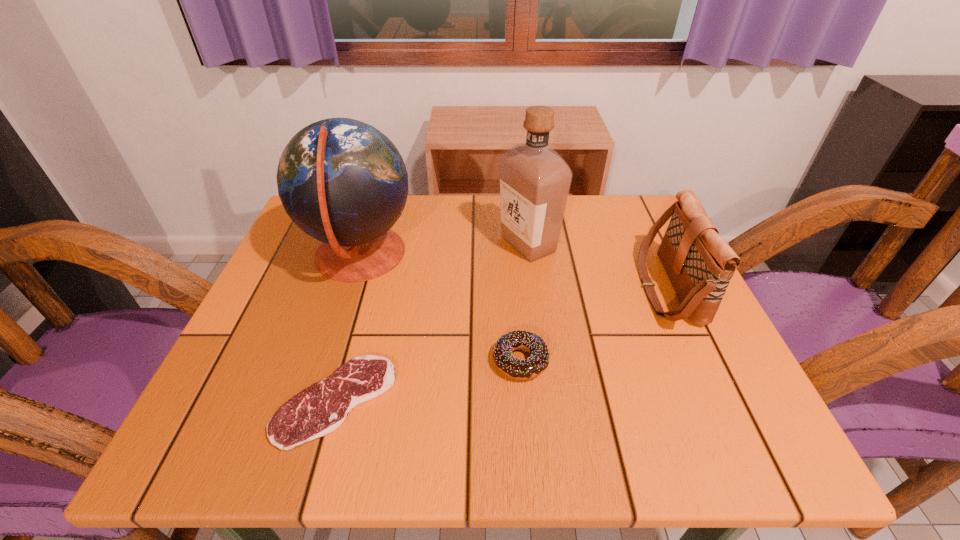
Identify the location of steak that is at the left edge. This screenshot has height=540, width=960. (320, 409).

Find the location of a particular element. object located at the right edge is located at coordinates (699, 263).

Locate an element on the screen. The width and height of the screenshot is (960, 540). object that is at the far left corner is located at coordinates (343, 182).

You are a GUI agent. You are given a task and a screenshot of the screen. Output one action in this format:
    pyautogui.click(x=<x>, y=<y>)
    Task: Click on the object situated at the near left corner
    
    Given the screenshot: What is the action you would take?
    pyautogui.click(x=320, y=409)

Find the location of a particular element. This screenshot has width=960, height=540. object situated at the far right corner is located at coordinates (699, 263).

In the image, there is a desktop. Identify the location of vacant space at the far edge. (474, 241).

The image size is (960, 540). I want to click on free location at the left edge, so click(300, 318).

What are the coordinates of `free space at the right edge of the desktop` in the screenshot? It's located at pyautogui.click(x=620, y=261).

In order to click on vacant point at the far right corner in this screenshot , I will do pyautogui.click(x=619, y=229).

You are a GUI agent. You are given a task and a screenshot of the screen. Output one action in this format:
    pyautogui.click(x=<x>, y=<y>)
    Task: Click on the vacant space at the near right corner of the desktop
    This screenshot has height=540, width=960.
    Given the screenshot: What is the action you would take?
    tap(686, 429)